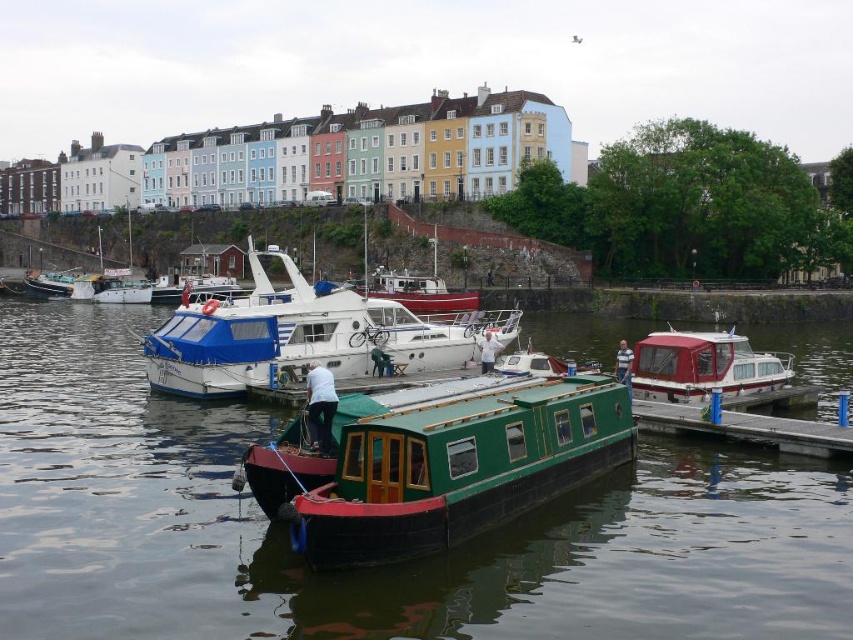
Is point (669, 397) behind point (102, 296)?

That is False.

Which is more to the right, red glossy boat at right or white glossy boat at center?

From the viewer's perspective, red glossy boat at right appears more on the right side.

Is point (764, 356) farther from camera compared to point (114, 301)?

No, (764, 356) is in front of (114, 301).

Locate an element on the screen. Image resolution: width=853 pixels, height=640 pixels. red glossy boat at right is located at coordinates (703, 365).

How much distance is there between green polished wood boat at center and dark blue jeans at center?

green polished wood boat at center and dark blue jeans at center are 6.24 meters apart.

Does green polished wood boat at center appear on the left side of dark blue jeans at center?

No, green polished wood boat at center is not to the left of dark blue jeans at center.

Which is behind, point (413, 461) or point (320, 440)?

The point (320, 440) is more distant.

At what (x,y) coordinates should I click in order to perform the action: click on green polished wood boat at center. Please return your answer as a coordinate pair (x, y). The height and width of the screenshot is (640, 853). Looking at the image, I should click on (459, 468).

Is point (184, 538) less distant than point (325, 404)?

Yes, point (184, 538) is in front of point (325, 404).

From the picture: Between green matte water at center and dark blue jeans at center, which one is positioned lower?

dark blue jeans at center is lower down.

Who is more forward, (112, 572) or (312, 433)?

Positioned in front is point (112, 572).

The height and width of the screenshot is (640, 853). Find the location of `green matte water at center`. green matte water at center is located at coordinates (379, 568).